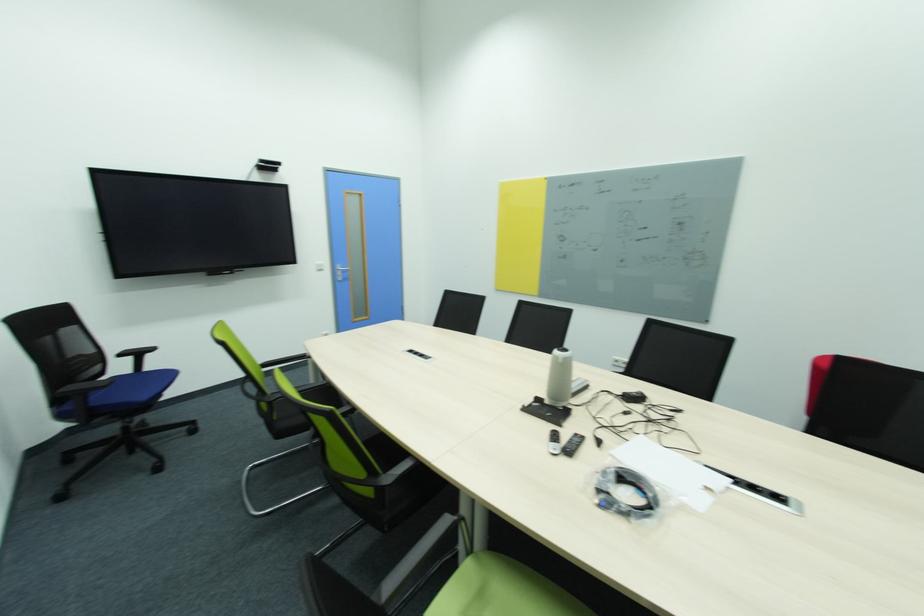
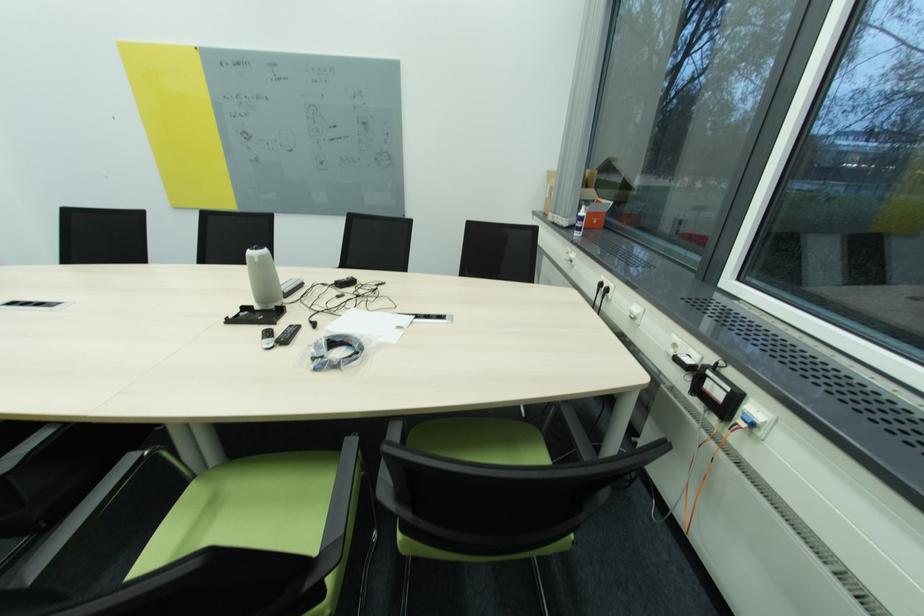
The point at (x=560, y=450) is marked in the first image. Where is the corresponding point in the second image?

(273, 345)